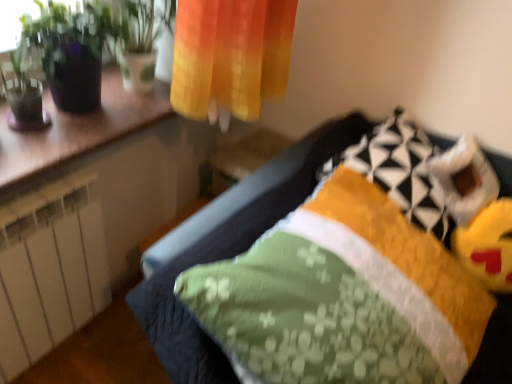
Question: From the image's perspective, is green glossy plant at upper left located above or below green fabric pillow at center, which is the second pillow from top to bottom?

Choices:
 (A) below
 (B) above

Answer: (B)

Question: Is green glossy plant at upper left inside or outside of green fabric pillow at center, the 1th pillow positioned from the bottom?

Choices:
 (A) outside
 (B) inside

Answer: (A)

Question: Considering the real-world distances, which object is farthest from the yellow plush toy at lower right?

Choices:
 (A) green fabric pillow at center, the 1th pillow positioned from the bottom
 (B) wooden counter at upper left
 (C) yellow quilted pillow at upper right, the first pillow from the top
 (D) green glossy plant at upper left

Answer: (D)

Question: Which of these objects is positioned closest to the green fabric pillow at center, the 1th pillow positioned from the bottom?

Choices:
 (A) green glossy plant at upper left
 (B) wooden counter at upper left
 (C) yellow plush toy at lower right
 (D) yellow quilted pillow at upper right, the first pillow from the top

Answer: (D)